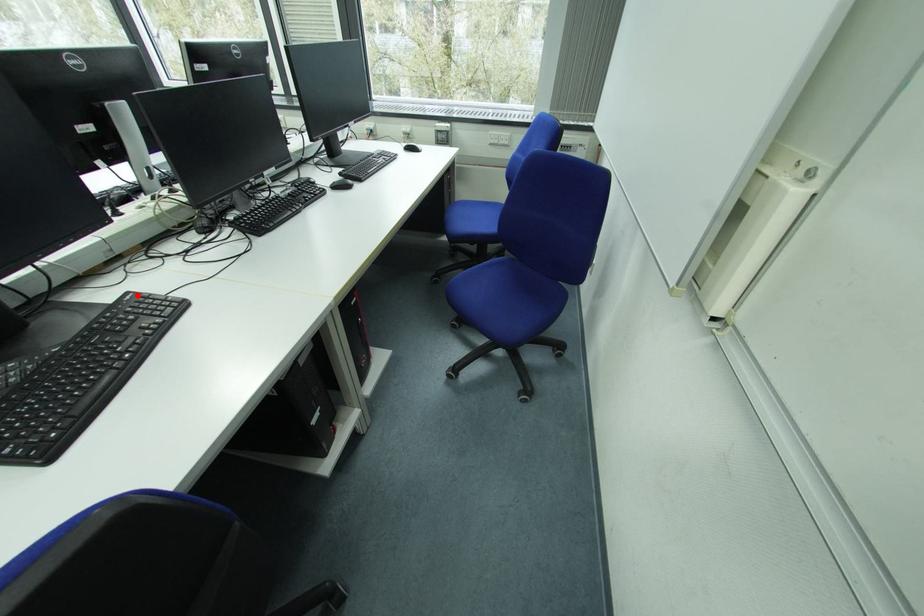
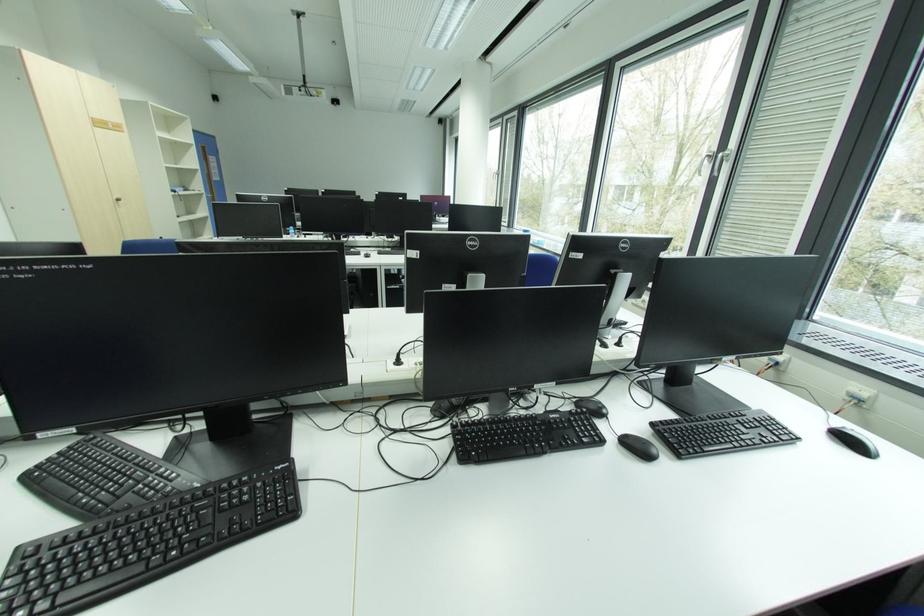
In the second image, find the point that corresponds to the highlighted location in the first image.

(293, 466)